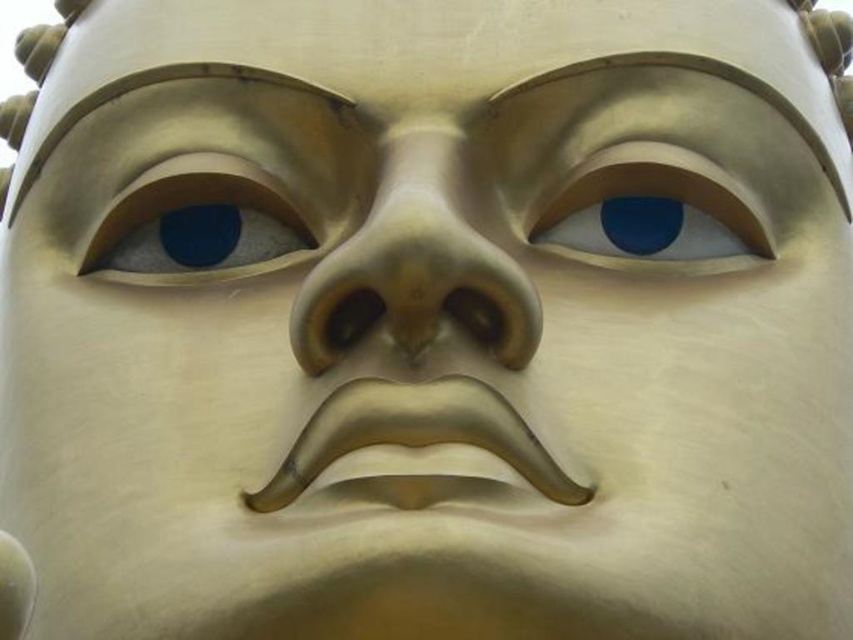
Question: Which object appears farthest from the camera in this image?

Choices:
 (A) matte gold eye at upper left
 (B) metallic gold eye at upper center
 (C) gold metallic nose at center

Answer: (A)

Question: Based on their relative distances, which object is farther from the gold metallic nose at center?

Choices:
 (A) metallic gold eye at upper center
 (B) matte gold eye at upper left

Answer: (A)

Question: Is gold metallic nose at center positioned before metallic gold eye at upper center?

Choices:
 (A) yes
 (B) no

Answer: (A)

Question: Is gold metallic nose at center further to the viewer compared to metallic gold eye at upper center?

Choices:
 (A) yes
 (B) no

Answer: (B)

Question: Is gold metallic nose at center to the left of matte gold eye at upper left from the viewer's perspective?

Choices:
 (A) yes
 (B) no

Answer: (B)

Question: Which of the following is the closest to the observer?

Choices:
 (A) 428,244
 (B) 708,221
 (C) 231,170

Answer: (A)